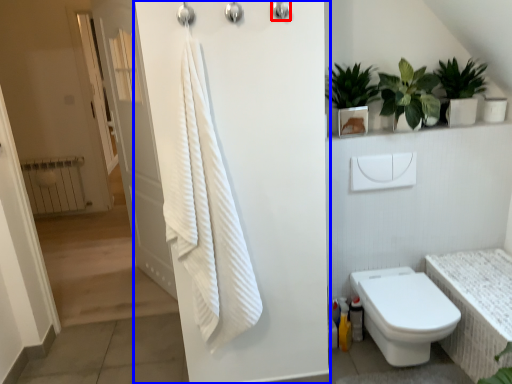
Question: Among these objects, which one is nearest to the camera, shower (highlighted by a red box) or screen door (highlighted by a blue box)?

Choices:
 (A) shower
 (B) screen door

Answer: (B)